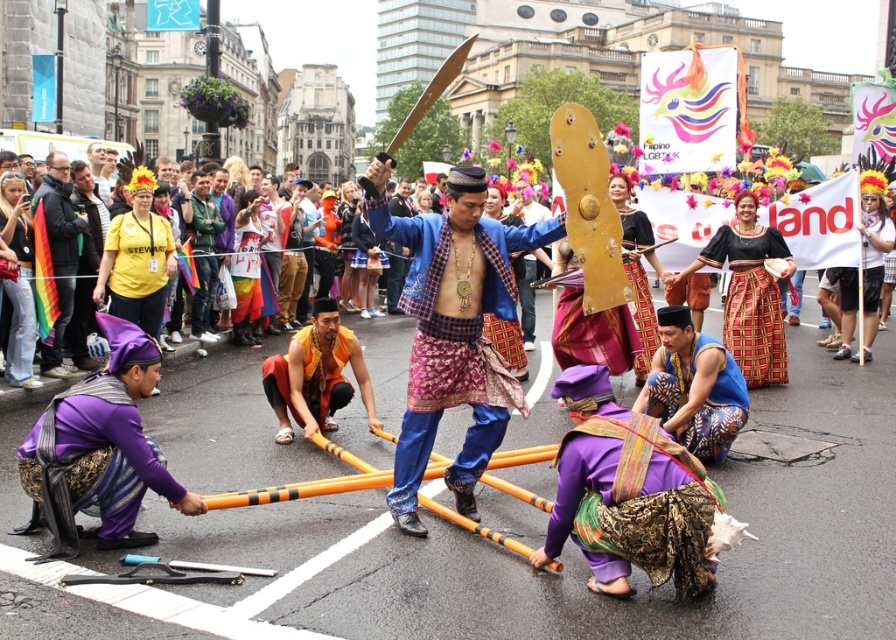
You are a photographer trying to capture the vibrant scene of the street performance. You want to ensure that both the shiny blue fabric at center and the rainbow flag at left are clearly visible in your photo. Based on their positions, which object should you focus on first to ensure both are in frame?

The shiny blue fabric at center is in front of the rainbow flag at left, so you should focus on the rainbow flag at left first to ensure both are in frame.

You are a photographer standing at the center of the street. You want to take a photo that includes both the point at coordinates point (x=451, y=317) and point (x=70, y=250). Which point should you focus on first to ensure both are in frame?

You should focus on point (x=70, y=250) first because it is behind point (x=451, y=317), so by focusing on the farther point, both points will be in focus.